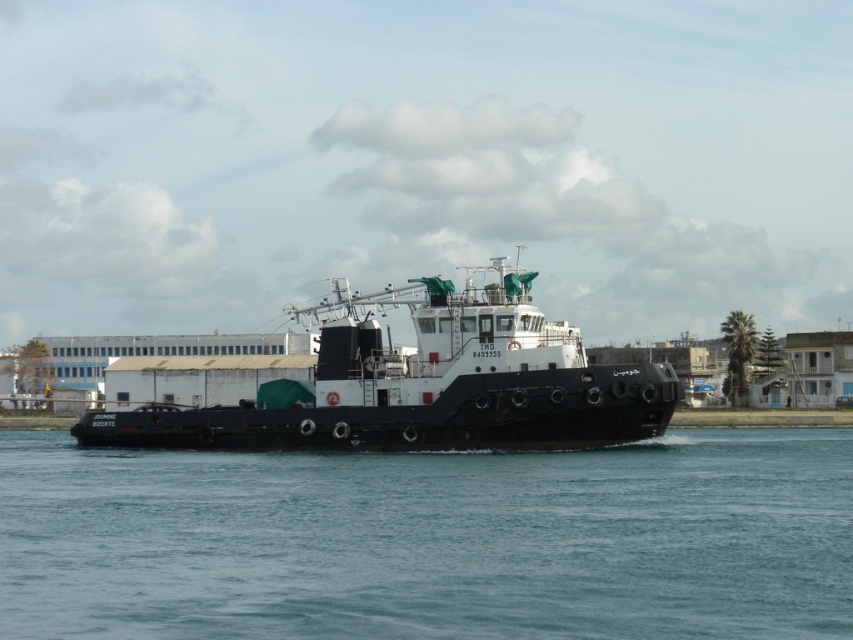
You are a sailor on the black matte tugboat at center. You want to check the water level below the boat. Which direction should you look to see the clear blue water at center?

The clear blue water at center is positioned under the black matte tugboat at center, so you should look downward to see the clear blue water at center below the boat.

You are on the deck of the barge and want to move from the point at coordinates point (701,520) to the point at coordinates point (407,397). Which direction should you walk to get closer to the second point?

To move from point (701,520) to point (407,397), you should walk towards the lower left direction since point (407,397) is behind and to the left of point (701,520).